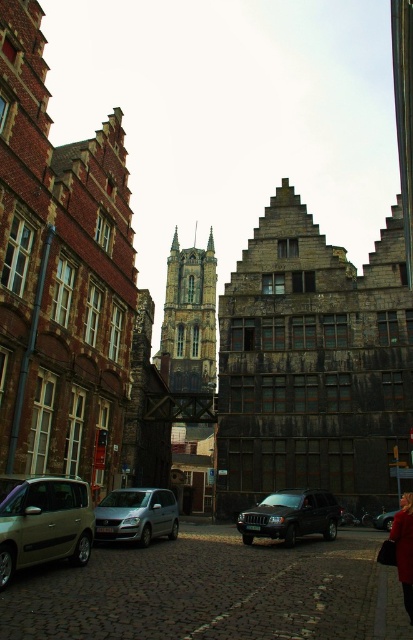
Is stone gothic tower at center below black matte suv at center?

No.

Between point (173, 324) and point (298, 524), which one is positioned behind?

The point (173, 324) is more distant.

Is point (209, 296) farther from camera compared to point (258, 520)?

Yes.

What are the coordinates of `stone gothic tower at center` in the screenshot? It's located at (189, 320).

Does point (299, 516) lie in front of point (398, 554)?

No.

Who is positioned more to the left, black matte suv at center or red leather coat at lower right?

black matte suv at center

The image size is (413, 640). What do you see at coordinates (291, 516) in the screenshot?
I see `black matte suv at center` at bounding box center [291, 516].

This screenshot has height=640, width=413. In order to click on black matte suv at center in this screenshot , I will do `click(291, 516)`.

Who is positioned more to the right, gold metallic van at lower left or red leather coat at lower right?

Positioned to the right is red leather coat at lower right.

Is point (54, 516) less distant than point (406, 588)?

That is False.

The image size is (413, 640). What do you see at coordinates (45, 524) in the screenshot? I see `gold metallic van at lower left` at bounding box center [45, 524].

The width and height of the screenshot is (413, 640). I want to click on gold metallic van at lower left, so click(x=45, y=524).